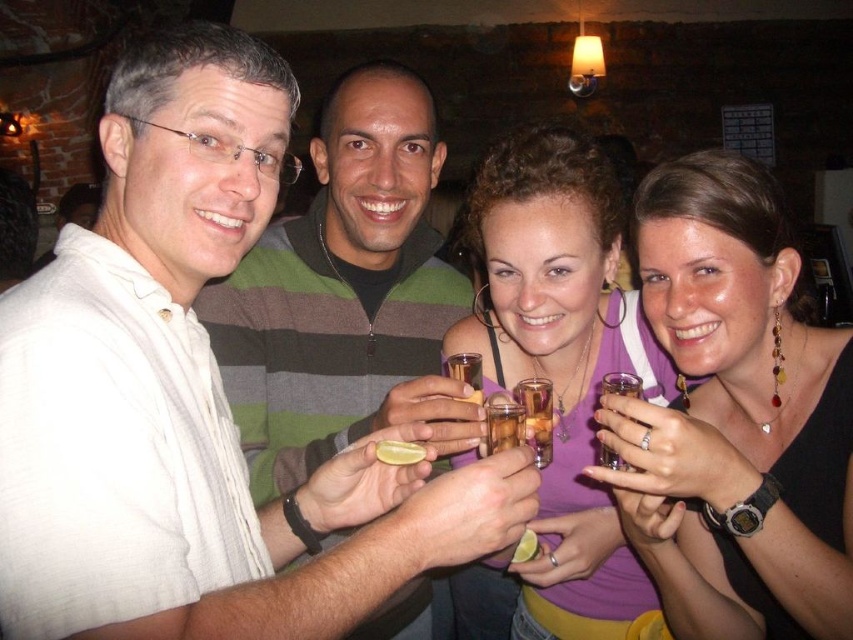
This screenshot has width=853, height=640. What do you see at coordinates (344, 292) in the screenshot?
I see `white matte shirt at left` at bounding box center [344, 292].

Is white matte shirt at left closer to the viewer compared to translucent glass shot glass at center?

No, white matte shirt at left is further to the viewer.

Between point (292, 422) and point (627, 394), which one is positioned in front?

Positioned in front is point (627, 394).

Find the location of a particular element. white matte shirt at left is located at coordinates (344, 292).

Between point (825, 547) and point (624, 465), which one is positioned in front?

Point (825, 547)

Can you confirm if matte black dress at center is taller than translucent glass shot glass at center?

Indeed, matte black dress at center has a greater height compared to translucent glass shot glass at center.

Does point (668, 252) come in front of point (605, 388)?

No, (668, 252) is behind (605, 388).

This screenshot has height=640, width=853. I want to click on matte black dress at center, so click(735, 417).

Is white matte shirt at left shorter than purple fabric tank top at center?

Yes.

Between point (331, 243) and point (625, 300), which one is positioned behind?

The point (331, 243) is behind.

Who is more forward, (424, 342) or (520, 173)?

Point (520, 173) is in front.

Where is `white matte shirt at left`? white matte shirt at left is located at coordinates (344, 292).